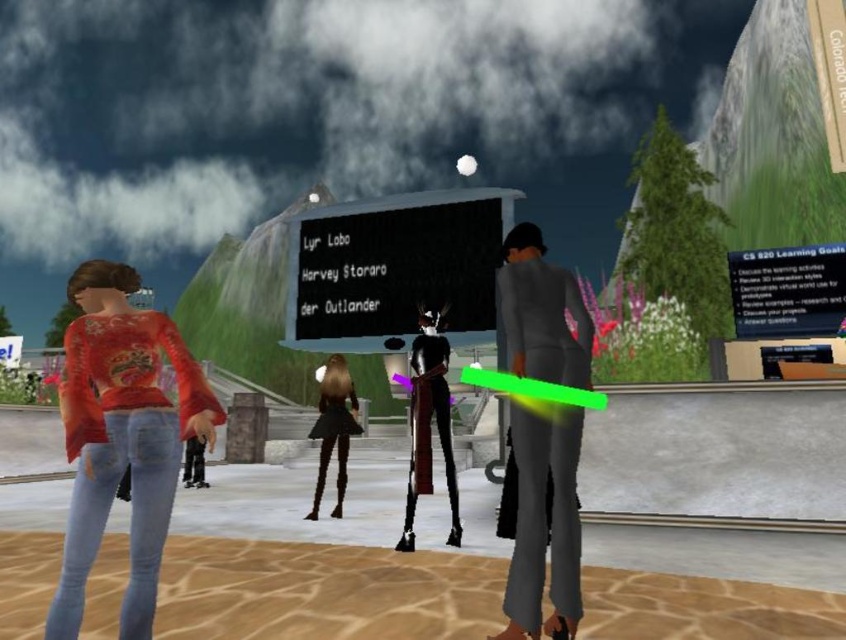
Question: Can you confirm if shiny black dress at center is bigger than black matte dress at center?

Choices:
 (A) yes
 (B) no

Answer: (B)

Question: Among these points, which one is nearest to the camera?

Choices:
 (A) (342, 444)
 (B) (183, 422)

Answer: (B)

Question: Among these points, which one is nearest to the camera?

Choices:
 (A) (452, 465)
 (B) (536, 611)
 (C) (97, 410)
 (D) (338, 474)

Answer: (C)

Question: Is matte gray suit at center smaller than shiny black dress at center?

Choices:
 (A) yes
 (B) no

Answer: (B)

Question: Based on their relative distances, which object is nearer to the shiny black dress at center?

Choices:
 (A) matte gray suit at center
 (B) black matte dress at center

Answer: (A)

Question: Observing the image, what is the correct spatial positioning of matte gray suit at center in reference to shiny black dress at center?

Choices:
 (A) below
 (B) above

Answer: (B)